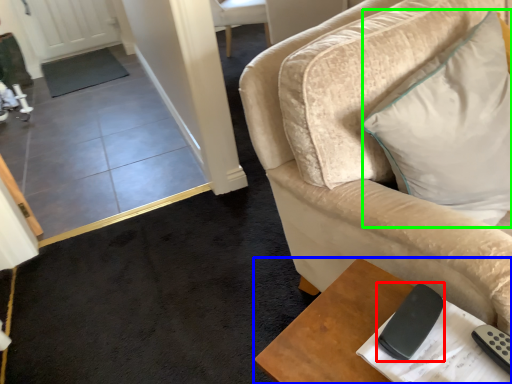
Question: Estimate the real-world distances between objects in this image. Which object is closer to remote (highlighted by a red box), table (highlighted by a blue box) or pillow (highlighted by a green box)?

Choices:
 (A) table
 (B) pillow

Answer: (A)